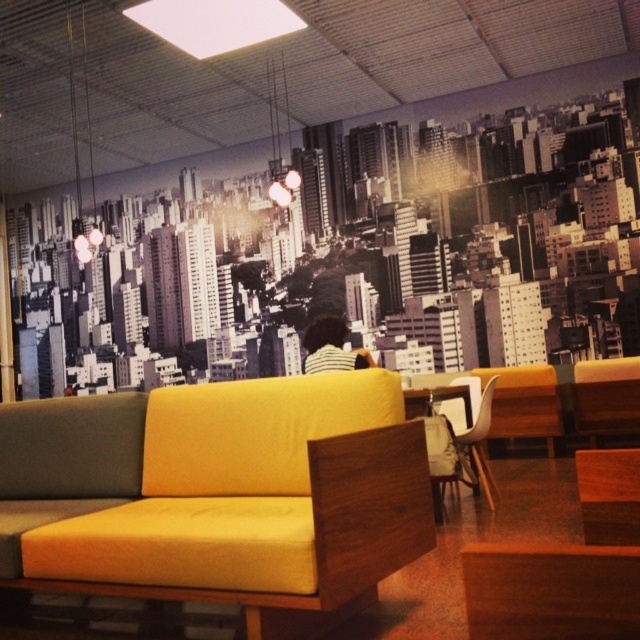
Between white plastic chair at lower right and white striped shirt at center, which one appears on the left side from the viewer's perspective?

white striped shirt at center

Is white plastic chair at lower right positioned in front of white striped shirt at center?

No, white plastic chair at lower right is further to the viewer.

Between point (458, 456) and point (342, 346), which one is positioned in front?

Point (458, 456) is more forward.

You are a GUI agent. You are given a task and a screenshot of the screen. Output one action in this format:
    pyautogui.click(x=<x>, y=<y>)
    Task: Click on the white plastic chair at lower right
    This screenshot has width=640, height=640.
    Given the screenshot: What is the action you would take?
    pyautogui.click(x=470, y=454)

From the picture: Who is shorter, yellow fabric couch at center or white striped shirt at center?

white striped shirt at center

Between point (161, 580) and point (317, 339), which one is positioned in front?

Point (161, 580)

Where is `yellow fabric couch at center`? Image resolution: width=640 pixels, height=640 pixels. yellow fabric couch at center is located at coordinates (227, 493).

Does yellow fabric couch at center appear on the right side of white plastic chair at lower right?

No, yellow fabric couch at center is not to the right of white plastic chair at lower right.

The height and width of the screenshot is (640, 640). What do you see at coordinates (227, 493) in the screenshot?
I see `yellow fabric couch at center` at bounding box center [227, 493].

The height and width of the screenshot is (640, 640). What are the coordinates of `yellow fabric couch at center` in the screenshot? It's located at (227, 493).